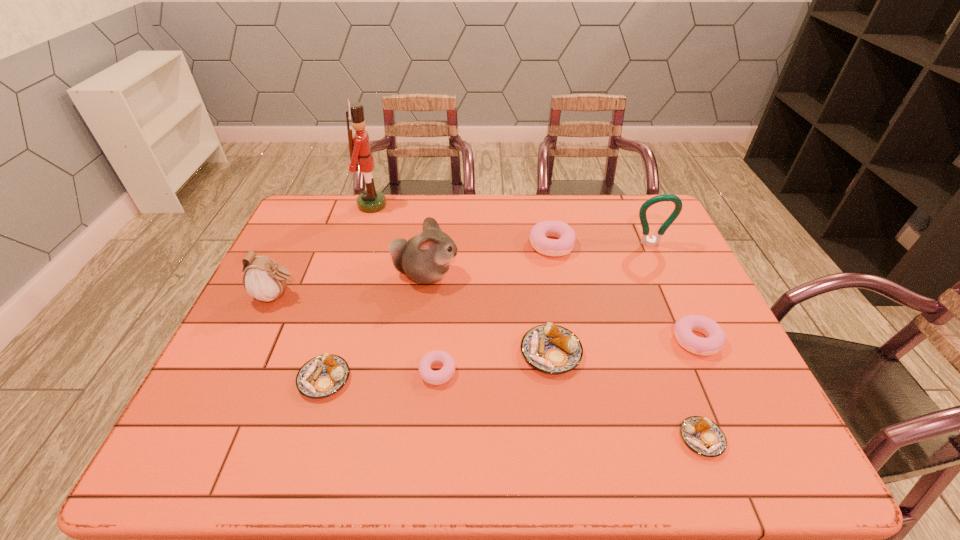
In order to click on vacant space situated 0.320m on the left of the farthest pastry in this screenshot , I will do `click(427, 245)`.

Image resolution: width=960 pixels, height=540 pixels. Find the location of `vacant point located on the back of the biggest brown pastry`. vacant point located on the back of the biggest brown pastry is located at coordinates pos(544,306).

The image size is (960, 540). I want to click on vacant space situated on the left of the rightmost pink pastry, so click(x=539, y=340).

What are the coordinates of `free point located 0.200m on the back of the second biggest brown pastry` in the screenshot? It's located at [x=348, y=299].

Identify the location of vacant space positioned on the front of the leftmost pink pastry. The image size is (960, 540). (435, 407).

I want to click on vacant space situated on the left of the smallest brown pastry, so click(x=647, y=438).

Find the location of `nutcracker that is at the far edge`. nutcracker that is at the far edge is located at coordinates (369, 201).

Find the location of a particular element. The image size is (960, 540). pastry located at the far edge is located at coordinates (566, 236).

Where is `object that is positioned at the near edge`? This screenshot has width=960, height=540. object that is positioned at the near edge is located at coordinates (703, 436).

Identify the location of object located at the left edge. Image resolution: width=960 pixels, height=540 pixels. (264, 280).